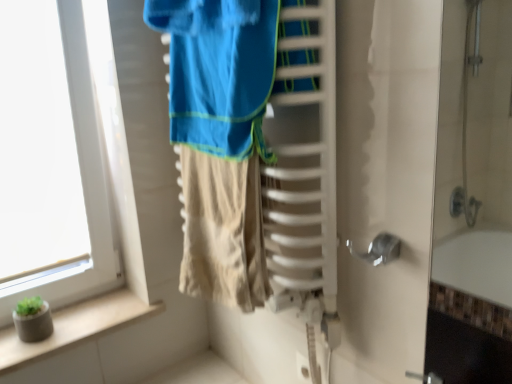
Question: Is white glass window at left smaller than green concrete planter at lower left?

Choices:
 (A) yes
 (B) no

Answer: (B)

Question: Is white glass window at left outside of green concrete planter at lower left?

Choices:
 (A) no
 (B) yes

Answer: (B)

Question: Is white glass window at left directly adjacent to green concrete planter at lower left?

Choices:
 (A) yes
 (B) no

Answer: (B)

Question: Is white glass window at left positioned with its back to green concrete planter at lower left?

Choices:
 (A) no
 (B) yes

Answer: (A)

Question: From a real-world perspective, is white glass window at left located higher than green concrete planter at lower left?

Choices:
 (A) no
 (B) yes

Answer: (B)

Question: From a real-world perspective, is white glass window at left below green concrete planter at lower left?

Choices:
 (A) no
 (B) yes

Answer: (A)

Question: From a real-world perspective, is green concrete planter at lower left below white glass window at left?

Choices:
 (A) no
 (B) yes

Answer: (B)

Question: Is green concrete planter at lower left far away from white glass window at left?

Choices:
 (A) no
 (B) yes

Answer: (A)

Question: Does green concrete planter at lower left lie behind white glass window at left?

Choices:
 (A) no
 (B) yes

Answer: (B)

Question: Considering the relative sizes of green concrete planter at lower left and white glass window at left in the image provided, is green concrete planter at lower left thinner than white glass window at left?

Choices:
 (A) no
 (B) yes

Answer: (A)

Question: Is green concrete planter at lower left taller than white glass window at left?

Choices:
 (A) no
 (B) yes

Answer: (A)

Question: From the image's perspective, is green concrete planter at lower left on white glass window at left?

Choices:
 (A) yes
 (B) no

Answer: (B)

Question: Is white glass window at left positioned in front of white plastic electric outlet at lower center?

Choices:
 (A) no
 (B) yes

Answer: (B)